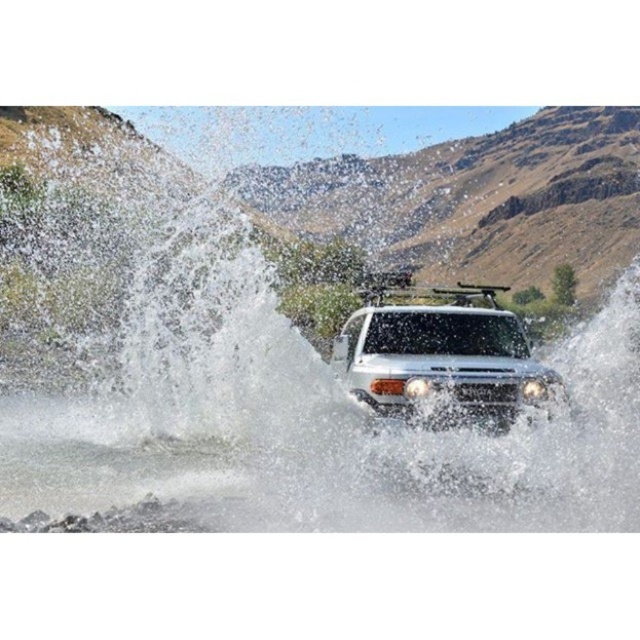
Question: Which of the following is the closest to the observer?

Choices:
 (A) (440, 378)
 (B) (58, 186)

Answer: (A)

Question: Among these points, which one is nearest to the camera?

Choices:
 (A) (160, 397)
 (B) (381, 291)

Answer: (A)

Question: Where is white frothy water at center located in relation to white matte jeep at center in the image?

Choices:
 (A) right
 (B) left

Answer: (B)

Question: In this image, where is white frothy water at center located relative to white matte jeep at center?

Choices:
 (A) above
 (B) below

Answer: (A)

Question: Does white frothy water at center lie in front of white matte jeep at center?

Choices:
 (A) yes
 (B) no

Answer: (A)

Question: Which of the following is the closest to the observer?

Choices:
 (A) (244, 228)
 (B) (497, 321)

Answer: (B)